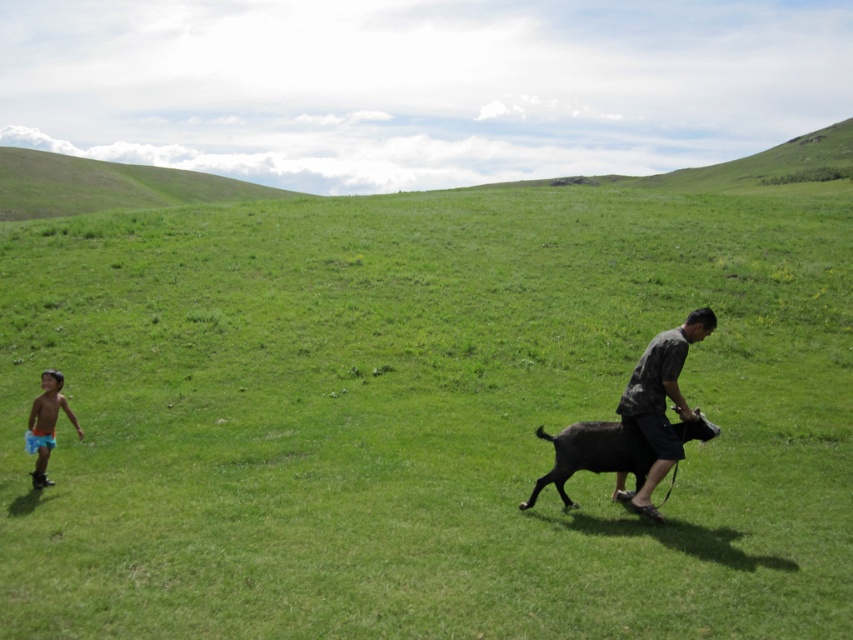
Question: Estimate the real-world distances between objects in this image. Which object is closer to the camouflage fabric shirt at right?

Choices:
 (A) blue shorts at lower left
 (B) black fur goat at right
 (C) green grassy field at center
 (D) green grassy hillside at upper left

Answer: (B)

Question: Is green grassy field at center above camouflage fabric shirt at right?

Choices:
 (A) no
 (B) yes

Answer: (B)

Question: Is camouflage fabric shirt at right positioned behind blue shorts at lower left?

Choices:
 (A) yes
 (B) no

Answer: (B)

Question: Which object is the closest to the green grassy field at center?

Choices:
 (A) camouflage fabric shirt at right
 (B) black fur goat at right
 (C) blue shorts at lower left

Answer: (B)

Question: Can you confirm if camouflage fabric shirt at right is bigger than black fur goat at right?

Choices:
 (A) no
 (B) yes

Answer: (B)

Question: Among these objects, which one is nearest to the camera?

Choices:
 (A) blue shorts at lower left
 (B) green grassy hillside at upper left

Answer: (A)